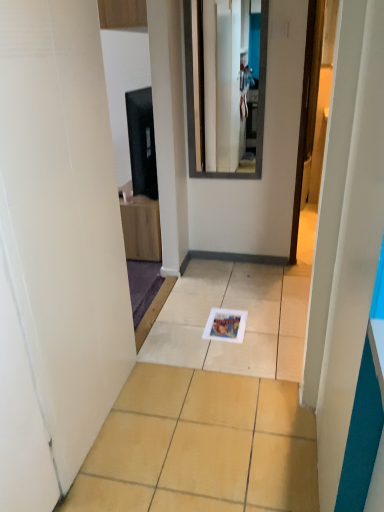
Question: Can you confirm if smooth glass mirror at upper center is wider than matte black tv at upper left?

Choices:
 (A) no
 (B) yes

Answer: (A)

Question: Is smooth glass mirror at upper center shorter than matte black tv at upper left?

Choices:
 (A) no
 (B) yes

Answer: (A)

Question: From the image's perspective, is smooth glass mirror at upper center beneath matte black tv at upper left?

Choices:
 (A) yes
 (B) no

Answer: (B)

Question: Can you confirm if smooth glass mirror at upper center is bigger than matte black tv at upper left?

Choices:
 (A) yes
 (B) no

Answer: (B)

Question: From a real-world perspective, is smooth glass mirror at upper center positioned under matte black tv at upper left based on gravity?

Choices:
 (A) no
 (B) yes

Answer: (A)

Question: Considering the positions of point (221, 70) and point (148, 400), is point (221, 70) closer or farther from the camera than point (148, 400)?

Choices:
 (A) farther
 (B) closer

Answer: (A)

Question: From a real-world perspective, relative to white glossy tile at center, is smooth glass mirror at upper center vertically above or below?

Choices:
 (A) below
 (B) above

Answer: (B)

Question: Looking at their shapes, would you say smooth glass mirror at upper center is wider or thinner than white glossy tile at center?

Choices:
 (A) wide
 (B) thin

Answer: (B)

Question: Is smooth glass mirror at upper center to the left or to the right of white glossy tile at center in the image?

Choices:
 (A) right
 (B) left

Answer: (A)

Question: From their relative heights in the image, would you say matte black tv at upper left is taller or shorter than white glossy tile at center?

Choices:
 (A) tall
 (B) short

Answer: (A)

Question: Considering the relative positions of matte black tv at upper left and white glossy tile at center in the image provided, is matte black tv at upper left to the left or to the right of white glossy tile at center?

Choices:
 (A) left
 (B) right

Answer: (A)

Question: Relative to white glossy tile at center, is matte black tv at upper left in front or behind?

Choices:
 (A) front
 (B) behind

Answer: (B)

Question: From the image's perspective, is matte black tv at upper left positioned above or below white glossy tile at center?

Choices:
 (A) below
 (B) above

Answer: (B)

Question: Looking at the image, does white glossy tile at center seem bigger or smaller compared to smooth glass mirror at upper center?

Choices:
 (A) small
 (B) big

Answer: (B)

Question: Visually, is white glossy tile at center positioned to the left or to the right of smooth glass mirror at upper center?

Choices:
 (A) left
 (B) right

Answer: (A)